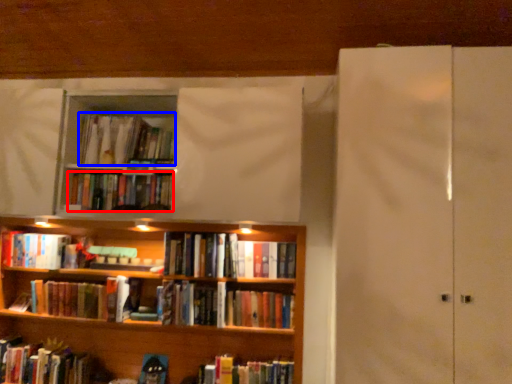
Question: Which of the following is the closest to the observer, book (highlighted by a red box) or book (highlighted by a blue box)?

Choices:
 (A) book
 (B) book

Answer: (A)